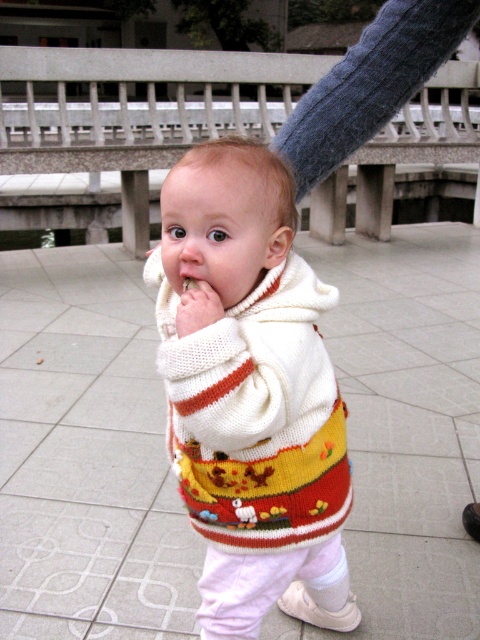
Question: Which point is farther to the camera?

Choices:
 (A) white tile pavement at center
 (B) white knitted sweater at center
 (C) white knitted hand at center

Answer: (A)

Question: Does white knitted hand at center have a smaller size compared to matte white mouth at center?

Choices:
 (A) no
 (B) yes

Answer: (A)

Question: Does white knitted sweater at center have a lesser width compared to matte white mouth at center?

Choices:
 (A) yes
 (B) no

Answer: (B)

Question: Which point is farther to the camera?

Choices:
 (A) matte white mouth at center
 (B) white tile pavement at center
 (C) white knitted hand at center

Answer: (B)

Question: Which point is closer to the camera?

Choices:
 (A) (240, 445)
 (B) (177, 320)
 (C) (382, 564)

Answer: (B)

Question: Can you confirm if white tile pavement at center is positioned to the left of white knitted sweater at center?

Choices:
 (A) yes
 (B) no

Answer: (A)